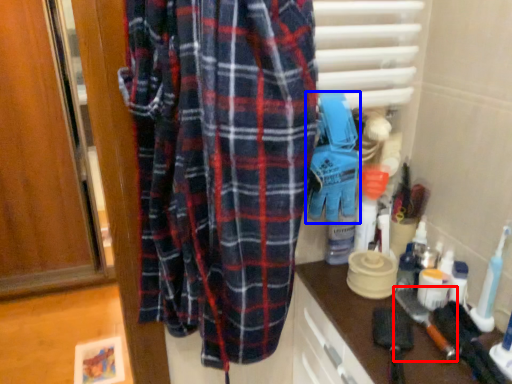
Question: Which of the following is the closest to the observer, brush (highlighted by a red box) or toy (highlighted by a blue box)?

Choices:
 (A) brush
 (B) toy

Answer: (B)